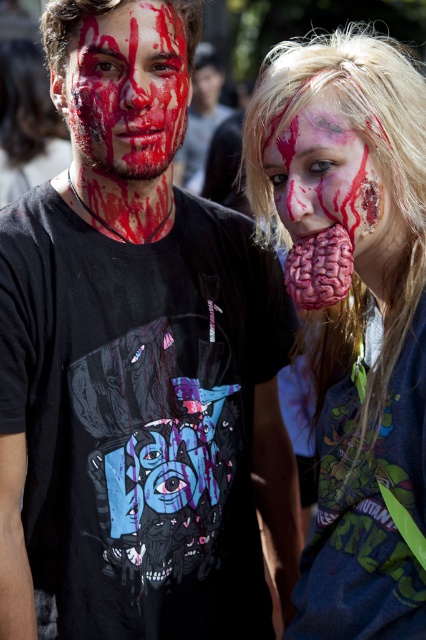
Between matte black t-shirt at left and rubber brain at center, which one is positioned lower?

Positioned lower is matte black t-shirt at left.

From the picture: Does matte black t-shirt at left have a larger size compared to rubber brain at center?

Yes.

Locate an element on the screen. matte black t-shirt at left is located at coordinates (138, 358).

Does matte black t-shirt at left appear under matte red paint at center?

Correct, matte black t-shirt at left is located below matte red paint at center.

Is matte black t-shirt at left taller than matte red paint at center?

Yes.

Between point (154, 513) and point (108, 134), which one is positioned behind?

The point (154, 513) is behind.

The height and width of the screenshot is (640, 426). What are the coordinates of `matte black t-shirt at left` in the screenshot? It's located at (138, 358).

This screenshot has width=426, height=640. Describe the element at coordinates (354, 314) in the screenshot. I see `rubber brain at center` at that location.

Does rubber brain at center lie in front of bloodied plastic brain at center?

Yes, it is.

This screenshot has height=640, width=426. I want to click on rubber brain at center, so click(354, 314).

Where is `rubber brain at center`? rubber brain at center is located at coordinates (354, 314).